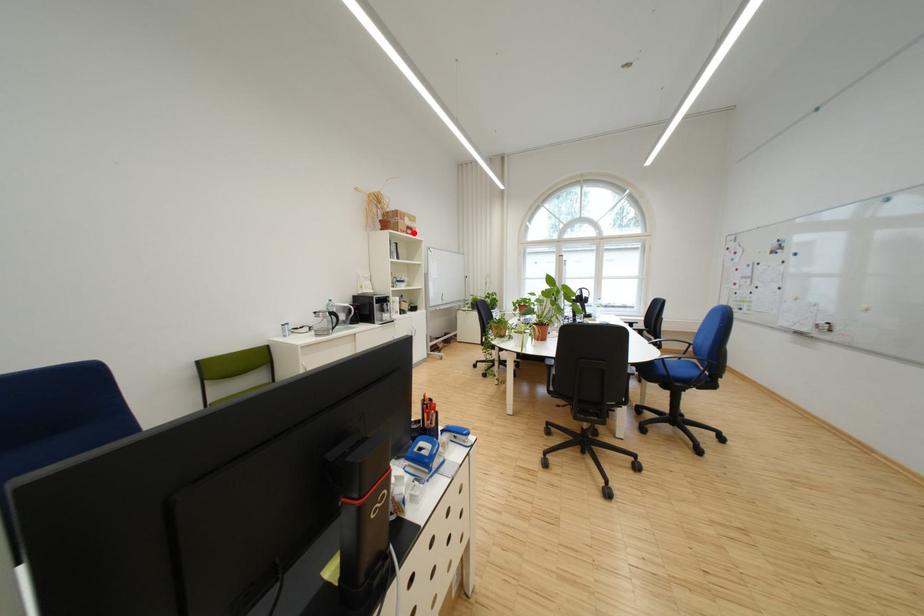
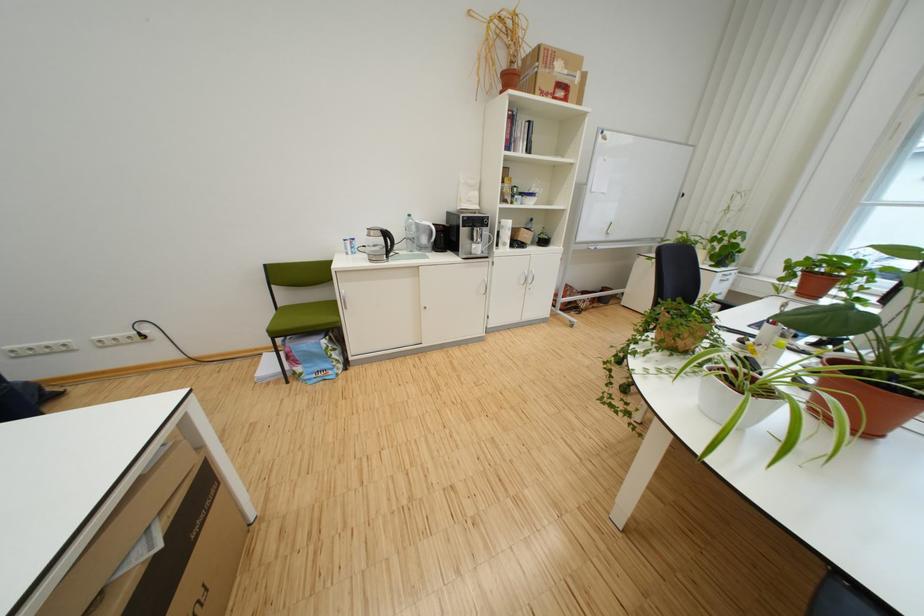
Find the pixel in the second image that matches the highlighted location in the first image.

(553, 95)